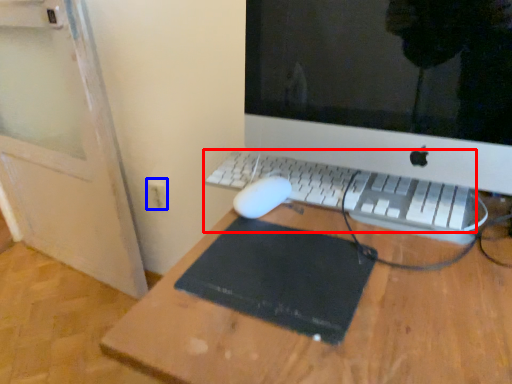
Question: Which point is closer to the camera, computer keyboard (highlighted by a red box) or electric outlet (highlighted by a blue box)?

Choices:
 (A) computer keyboard
 (B) electric outlet

Answer: (A)